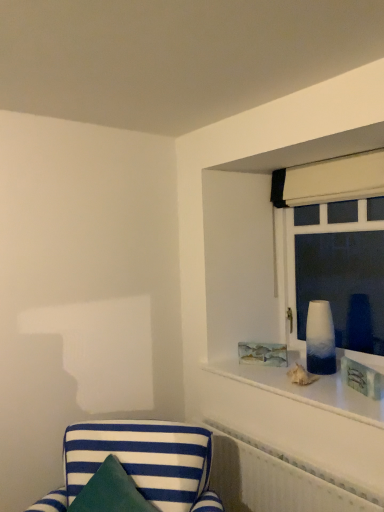
Question: Is white textured radiator at lower right wider or thinner than matte wooden picture frame at upper right?

Choices:
 (A) wide
 (B) thin

Answer: (A)

Question: In the image, is white textured radiator at lower right on the left side or the right side of matte wooden picture frame at upper right?

Choices:
 (A) left
 (B) right

Answer: (A)

Question: Estimate the real-world distances between objects in this image. Which object is closer to the white fabric curtain at upper right?

Choices:
 (A) matte wooden picture frame at upper right
 (B) ombre glass vase at upper right
 (C) blue and white striped fabric chair at lower left
 (D) white textured radiator at lower right
 (E) white gradient glass vase at right

Answer: (B)

Question: Which object is positioned closest to the white gradient glass vase at right?

Choices:
 (A) blue and white striped fabric chair at lower left
 (B) white textured radiator at lower right
 (C) white fabric curtain at upper right
 (D) matte wooden picture frame at upper right
 (E) ombre glass vase at upper right

Answer: (D)